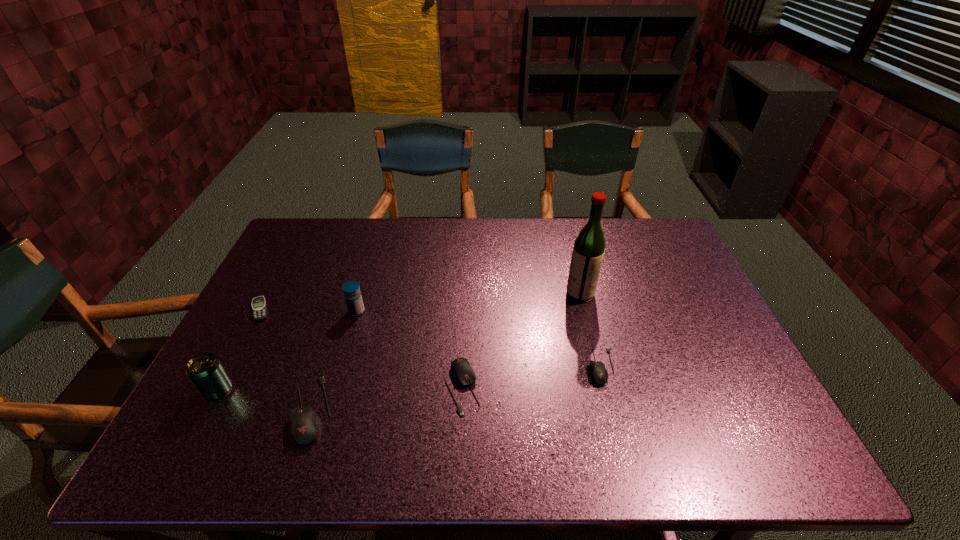
Identify the location of mouse that can be found as the second closest to the third object from right to left. The image size is (960, 540). (599, 374).

At what (x,y) coordinates should I click in order to perform the action: click on the closest mouse to the leftmost mouse. Please return your answer as a coordinate pair (x, y). Looking at the image, I should click on (462, 373).

Locate an element on the screen. The width and height of the screenshot is (960, 540). free space that satisfies the following two spatial constraints: 1. on the back side of the beer can; 2. on the right side of the second mouse from right to left is located at coordinates (220, 387).

Where is `vacant region that satisfies the following two spatial constraints: 1. on the back side of the beer can; 2. on the right side of the medicine`? vacant region that satisfies the following two spatial constraints: 1. on the back side of the beer can; 2. on the right side of the medicine is located at coordinates (259, 312).

The height and width of the screenshot is (540, 960). What are the coordinates of `free space that satisfies the following two spatial constraints: 1. on the front side of the medicine; 2. on the left side of the fifth tallest object` in the screenshot? It's located at (335, 387).

I want to click on vacant space that satisfies the following two spatial constraints: 1. on the label of the tallest object; 2. on the front side of the beer can, so click(605, 390).

Identify the location of free space in the image that satisfies the following two spatial constraints: 1. on the label of the tallest object; 2. on the right side of the shortest mouse. (598, 367).

Identify the location of free space that satisfies the following two spatial constraints: 1. on the front side of the shortest object; 2. on the left side of the beer can. This screenshot has width=960, height=540. (218, 390).